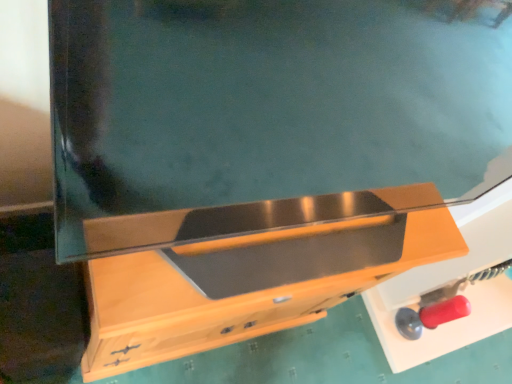
Locate an element on the screen. This screenshot has height=384, width=512. wooden drawer at center is located at coordinates (248, 285).

This screenshot has height=384, width=512. Describe the element at coordinates (248, 285) in the screenshot. I see `wooden drawer at center` at that location.

Locate an element on the screen. This screenshot has width=512, height=384. wooden drawer at center is located at coordinates (248, 285).